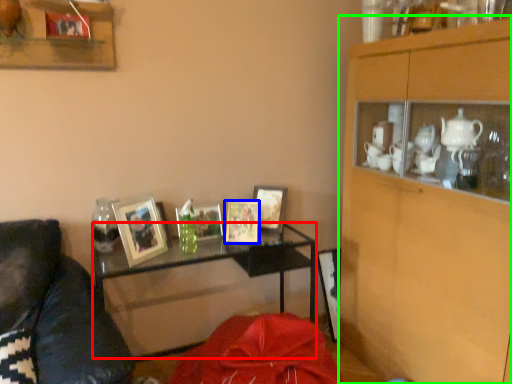
Question: Which object is positioned closest to desk (highlighted by a red box)? Select from picture frame (highlighted by a blue box) and cabinetry (highlighted by a green box).

Choices:
 (A) picture frame
 (B) cabinetry

Answer: (A)